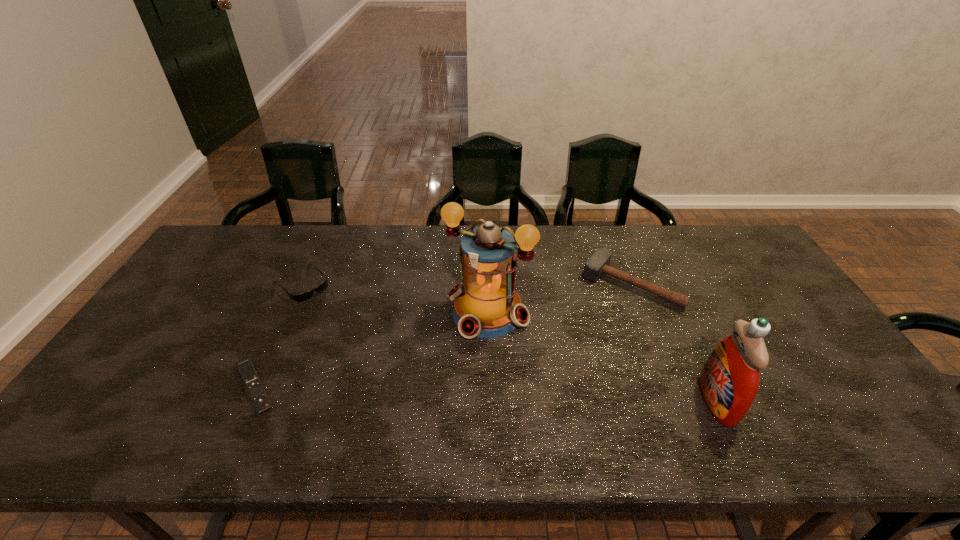
The width and height of the screenshot is (960, 540). Identify the location of free space that satisfies the following two spatial constraints: 1. on the front side of the fourth shortest object; 2. on the front surface of the remote control. (249, 401).